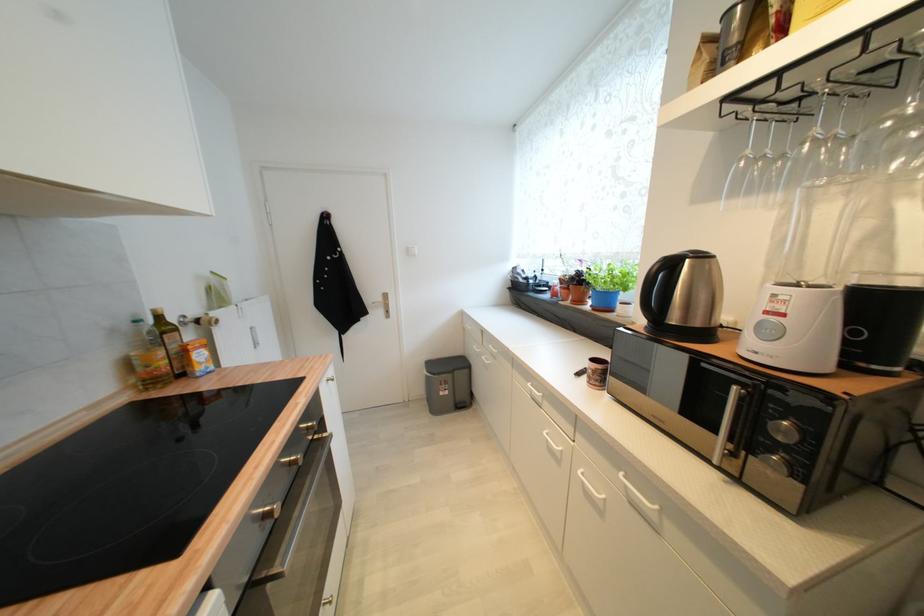
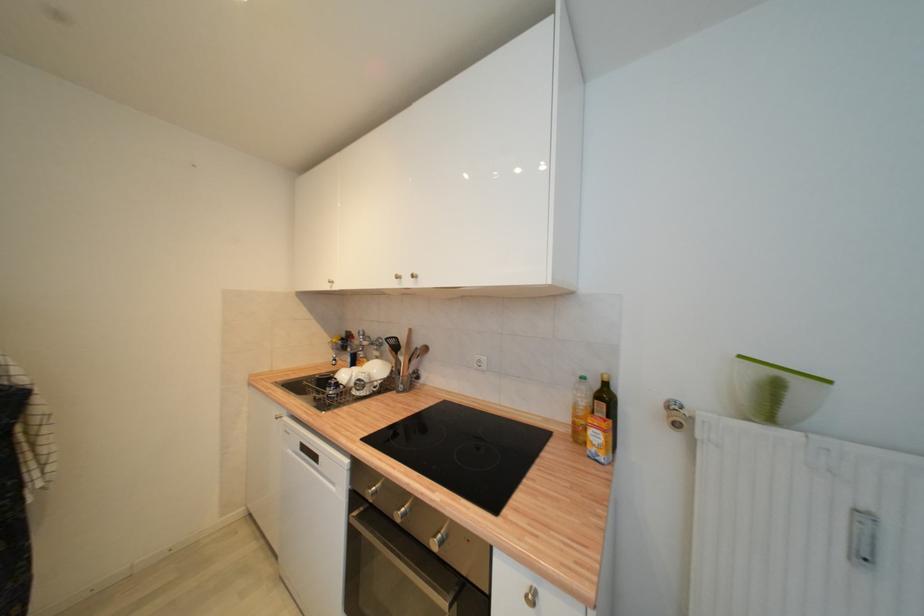
Locate, in the second image, the point that corresponds to pixel 261 346 in the first image.

(869, 560)